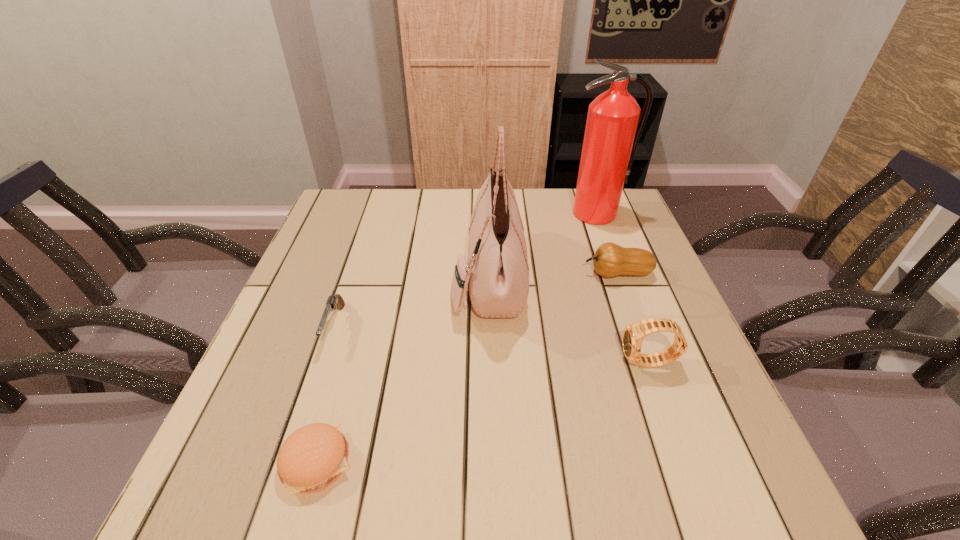
At what (x,y) coordinates should I click in order to perform the action: click on free space between the farthest object and the fourth shortest object. Please return your answer as a coordinate pair (x, y). Image resolution: width=960 pixels, height=540 pixels. Looking at the image, I should click on (622, 288).

Locate an element on the screen. This screenshot has height=540, width=960. free spot between the gourd and the fourth shortest object is located at coordinates (634, 318).

The width and height of the screenshot is (960, 540). I want to click on object that can be found as the third closest to the fifth tallest object, so click(610, 260).

You are a GUI agent. You are given a task and a screenshot of the screen. Output one action in this format:
    pyautogui.click(x=<x>, y=<y>)
    Task: Click on the closest object relative to the handbag
    
    Given the screenshot: What is the action you would take?
    pyautogui.click(x=610, y=260)

Where is `vacant area in the image that satisfies the following two spatial constraints: 1. on the stem side of the gourd; 2. aiming along the barrel of the fifth tallest object`? This screenshot has height=540, width=960. vacant area in the image that satisfies the following two spatial constraints: 1. on the stem side of the gourd; 2. aiming along the barrel of the fifth tallest object is located at coordinates (636, 326).

Locate an element on the screen. The image size is (960, 540). vacant area in the image that satisfies the following two spatial constraints: 1. at the nozzle of the farthest object; 2. on the side of the handbag with the attached pouch is located at coordinates (619, 278).

Where is `free space in the image that satisfies the following two spatial constraints: 1. at the nozzle of the fire extinguisher; 2. on the face of the fourth shortest object`? This screenshot has height=540, width=960. free space in the image that satisfies the following two spatial constraints: 1. at the nozzle of the fire extinguisher; 2. on the face of the fourth shortest object is located at coordinates (x=650, y=363).

Identify the location of free space that satisfies the following two spatial constraints: 1. at the nozzle of the farthest object; 2. on the stem side of the third shortest object. (618, 273).

Locate an element on the screen. This screenshot has height=540, width=960. vacant space that satisfies the following two spatial constraints: 1. on the side of the handbag with the attached pouch; 2. aiming along the barrel of the fifth tallest object is located at coordinates (490, 326).

Find the location of a particular element. The width and height of the screenshot is (960, 540). free region that satisfies the following two spatial constraints: 1. on the face of the fourth shortest object; 2. on the front side of the shortest object is located at coordinates (684, 462).